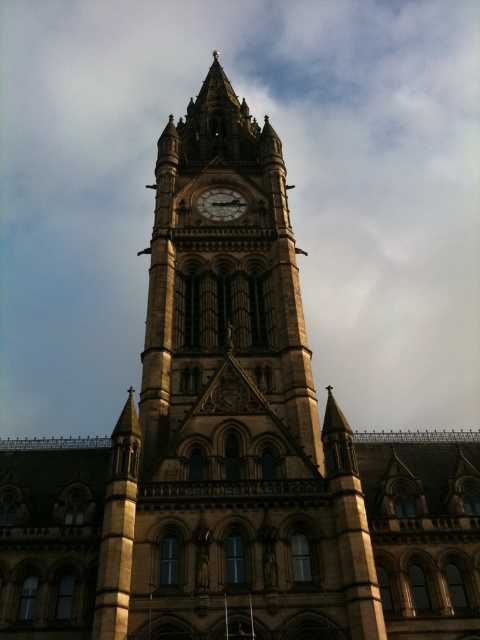
Can you confirm if golden stone clock tower at center is bigger than dark brown wooden clock at center?

Indeed, golden stone clock tower at center has a larger size compared to dark brown wooden clock at center.

Which is in front, point (277, 397) or point (232, 208)?

Point (277, 397) is in front.

Locate an element on the screen. The width and height of the screenshot is (480, 640). golden stone clock tower at center is located at coordinates (223, 291).